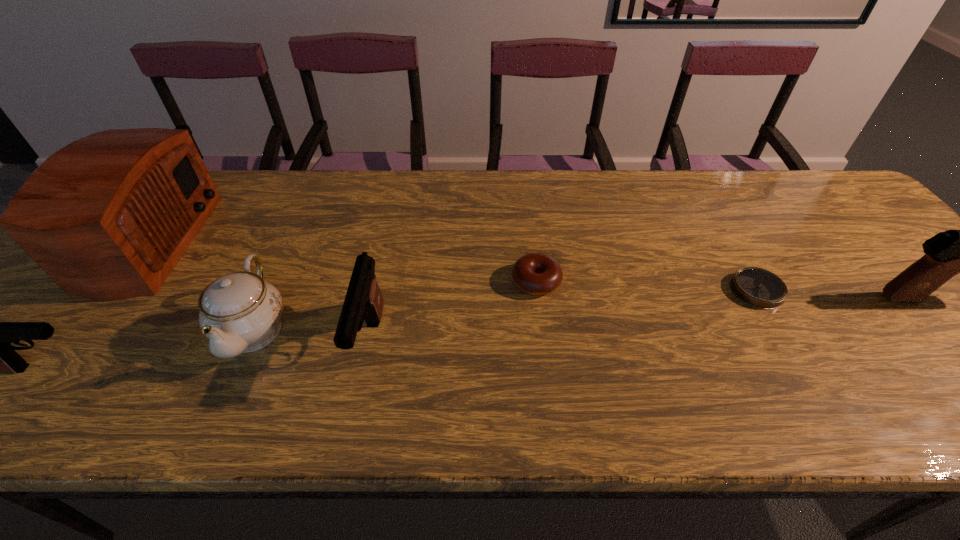
You are a GUI agent. You are given a task and a screenshot of the screen. Output one action in this format:
    pyautogui.click(x=<x>, y=<y>)
    Task: Click on the spot to insert another pistol for uniform distribution
    The height and width of the screenshot is (540, 960).
    Given the screenshot: What is the action you would take?
    pyautogui.click(x=666, y=319)